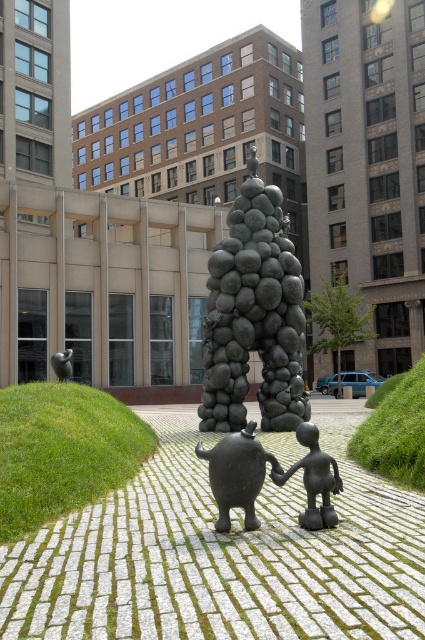
Question: Estimate the real-world distances between objects in this image. Which object is closer to the dark gray textured sculpture at center?

Choices:
 (A) polished bronze statue at center
 (B) matte black figure at center
 (C) matte black sculpture at center

Answer: (A)

Question: Which of the following is the farthest from the observer?

Choices:
 (A) (317, 451)
 (B) (288, 243)

Answer: (B)

Question: Can you confirm if dark gray textured sculpture at center is positioned to the left of matte black sculpture at center?

Choices:
 (A) no
 (B) yes

Answer: (A)

Question: Does matte black sculpture at center come behind matte black figure at center?

Choices:
 (A) yes
 (B) no

Answer: (B)

Question: Which of the following is the farthest from the observer?

Choices:
 (A) polished bronze statue at center
 (B) matte black figure at center

Answer: (A)

Question: Is dark gray textured sculpture at center positioned behind polished bronze statue at center?

Choices:
 (A) no
 (B) yes

Answer: (B)